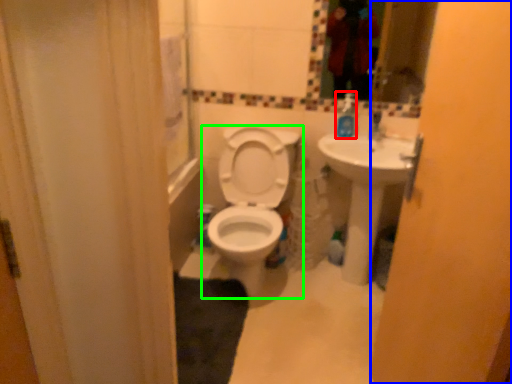
Question: Which object is the farthest from soap dispenser (highlighted by a red box)? Choose among these: screen door (highlighted by a blue box) or toilet (highlighted by a green box).

Choices:
 (A) screen door
 (B) toilet

Answer: (A)